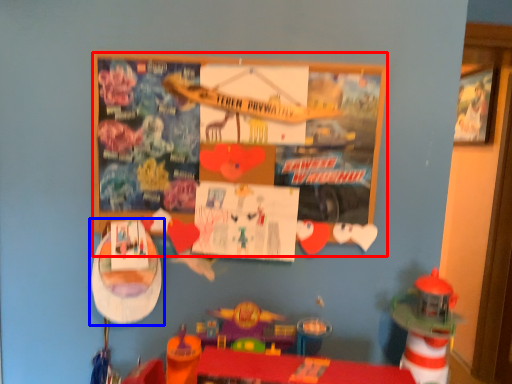
Question: Which object appears farthest to the camera in this image, bulletin board (highlighted by a red box) or toy (highlighted by a blue box)?

Choices:
 (A) bulletin board
 (B) toy

Answer: (B)